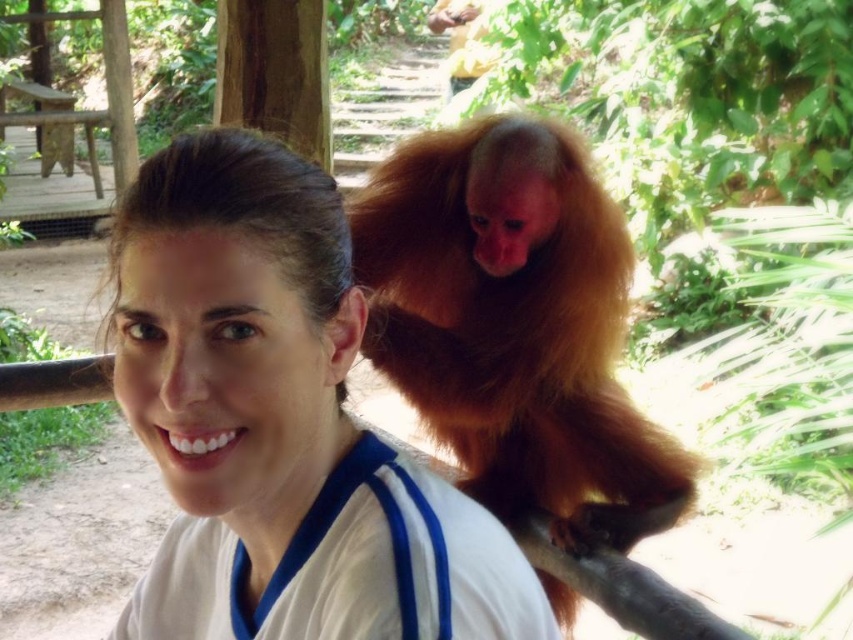
Does white matte shirt at center have a lesser width compared to golden fur monkey at upper right?

Yes, white matte shirt at center is thinner than golden fur monkey at upper right.

Is the position of white matte shirt at center less distant than that of golden fur monkey at upper right?

Yes, white matte shirt at center is in front of golden fur monkey at upper right.

Is point (485, 566) farther from camera compared to point (579, 172)?

No, it is not.

You are a GUI agent. You are given a task and a screenshot of the screen. Output one action in this format:
    pyautogui.click(x=<x>, y=<y>)
    Task: Click on the white matte shirt at center
    Image resolution: width=853 pixels, height=640 pixels.
    Given the screenshot: What is the action you would take?
    pyautogui.click(x=280, y=422)